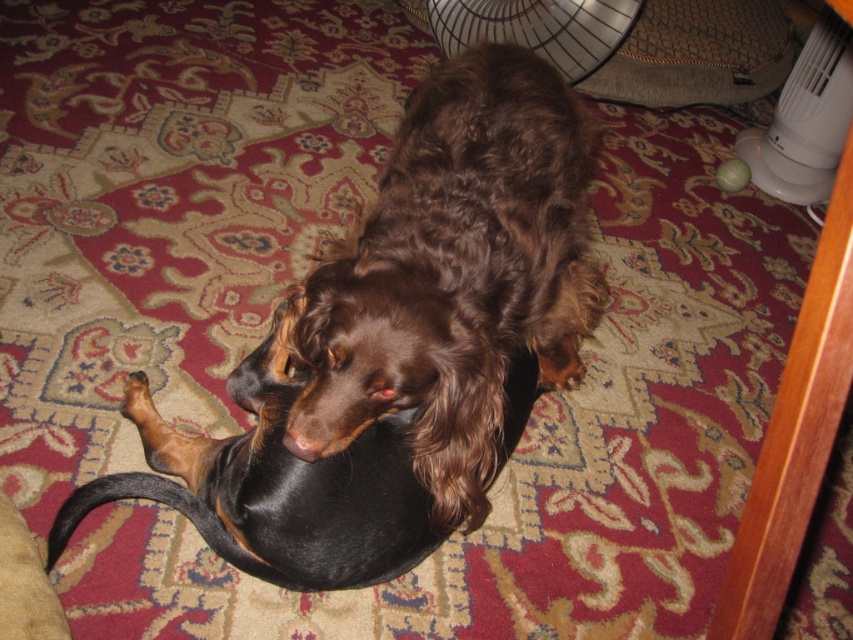
You are standing in a room and see the brown furry dog at center and the white plastic fan at upper right. Which object is closer to the left side of the room?

The brown furry dog at center is closer to the left side of the room than the white plastic fan at upper right.

You are a pet sitter who needs to ensure the brown furry dog at center stays cool during a hot day. The metallic silver fan at upper center is available. Can you position the fan so it can blow air directly onto the dog?

Yes, since the brown furry dog at center is located below the metallic silver fan at upper center, the fan can be angled downward to direct airflow towards the dog.

You are standing in a room with a dog and two fans. The white plastic fan at upper right and the metallic silver fan at upper center are both above you. Which fan is taller?

The white plastic fan at upper right is much taller than the metallic silver fan at upper center.